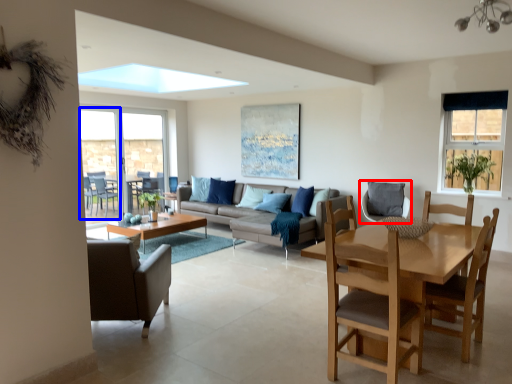
Question: Which object appears farthest to the camera in this image, chair (highlighted by a red box) or screen door (highlighted by a blue box)?

Choices:
 (A) chair
 (B) screen door

Answer: (B)